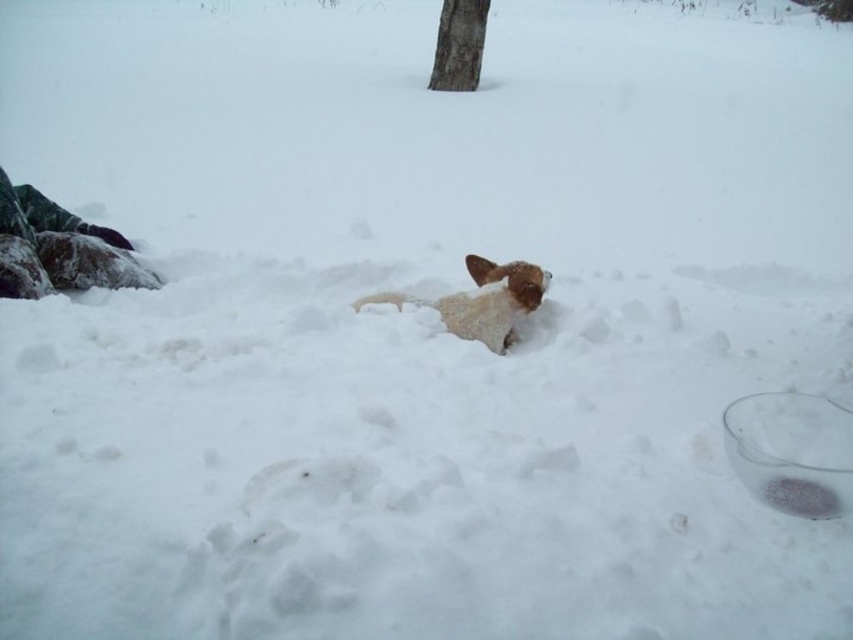
Can you confirm if brown fur dog at center is smaller than brown rough bark tree at upper center?

Yes, brown fur dog at center is smaller than brown rough bark tree at upper center.

Looking at this image, which of these two, brown fur dog at center or brown rough bark tree at upper center, stands taller?

brown rough bark tree at upper center is taller.

Between point (505, 332) and point (461, 51), which one is positioned in front?

Point (505, 332) is in front.

Identify the location of brown fur dog at center. This screenshot has height=640, width=853. (482, 300).